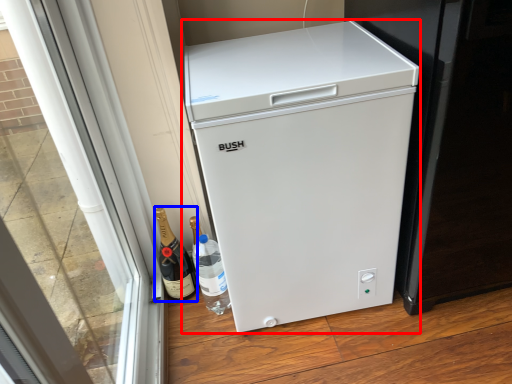
Question: Which object appears farthest to the camera in this image, refrigerator (highlighted by a red box) or wine (highlighted by a blue box)?

Choices:
 (A) refrigerator
 (B) wine

Answer: (B)